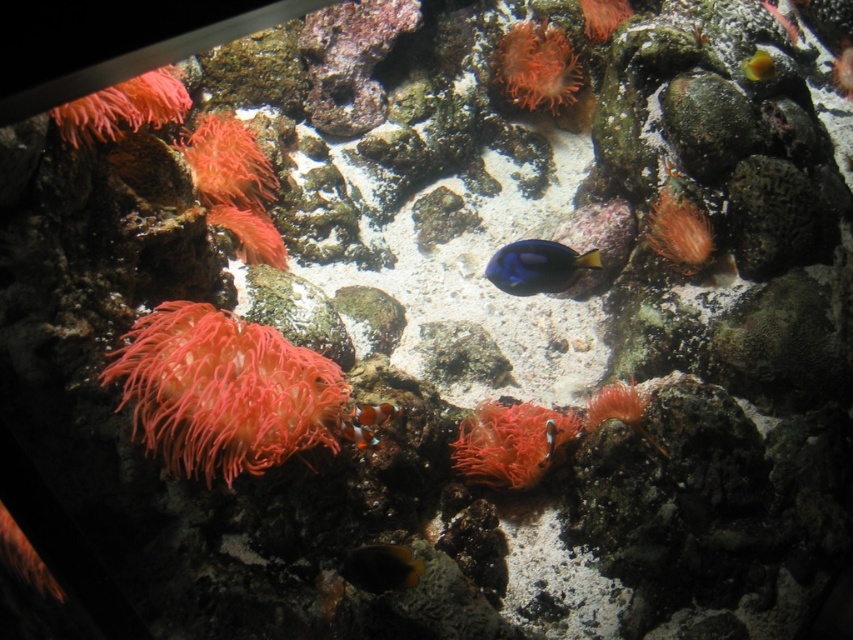
From the picture: You are a diver who wants to take a photo of the point at coordinates (x=556, y=38) in the underwater scene. If your camera has a maximum focus range of 10 feet, will you be able to capture the point clearly?

The point at coordinates (x=556, y=38) is 10.36 feet away from the camera, which exceeds the camera maximum focus range of 10 feet. Therefore, you won not be able to capture the point clearly.

You are a marine biologist observing an underwater scene in an aquarium. There is a fuzzy coral at upper center represented by point (537, 67). Can you determine the position of the fuzzy coral at upper center relative to the center of the image?

The fuzzy coral at upper center is located at point (537, 67), which is slightly to the left and above the center of the image.

Consider the image. You are an underwater photographer aiming to capture a clear shot of both the anemones and clownfish. You notice two points marked in the scene. If you position your camera at point (482, 419), will the other point (563, 92) block your view of the anemones and clownfish?

Point (482, 419) is in front of point (563, 92), so positioning your camera there would block the view of the anemones and clownfish behind point (563, 92).